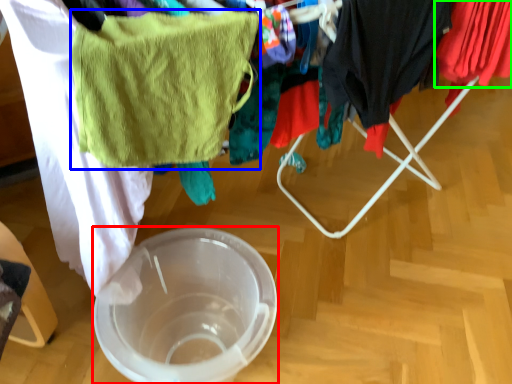
Question: Which is nearer to the glass bowl (highlighted by a red box)? towel/napkin (highlighted by a blue box) or clothing (highlighted by a green box).

Choices:
 (A) towel/napkin
 (B) clothing

Answer: (A)